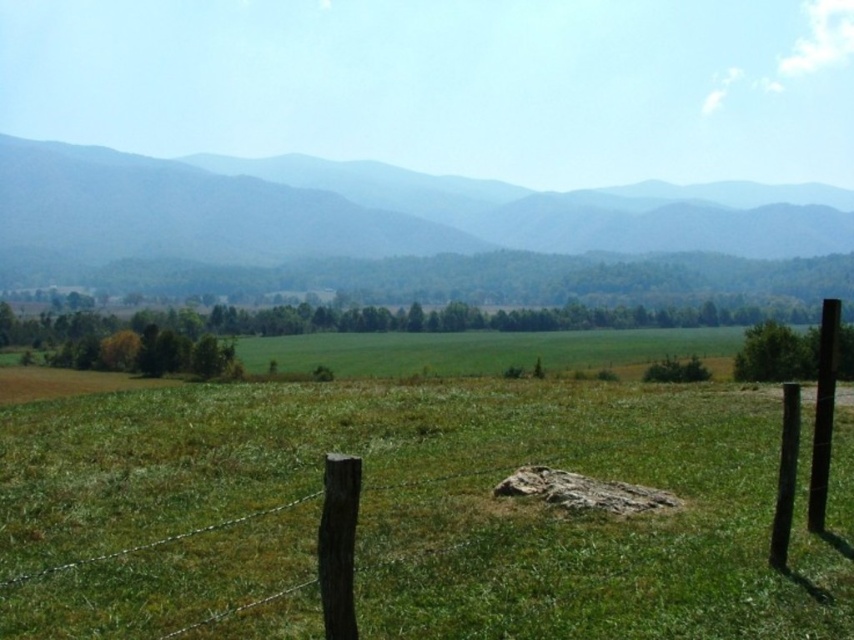
Is green forested mountain at upper center taller than black smooth pole at right?

Yes.

Does green forested mountain at upper center appear under black smooth pole at right?

No, green forested mountain at upper center is not below black smooth pole at right.

Is point (410, 209) in front of point (828, 324)?

No, (410, 209) is further to viewer.

The height and width of the screenshot is (640, 854). What are the coordinates of `green forested mountain at upper center` in the screenshot? It's located at (351, 221).